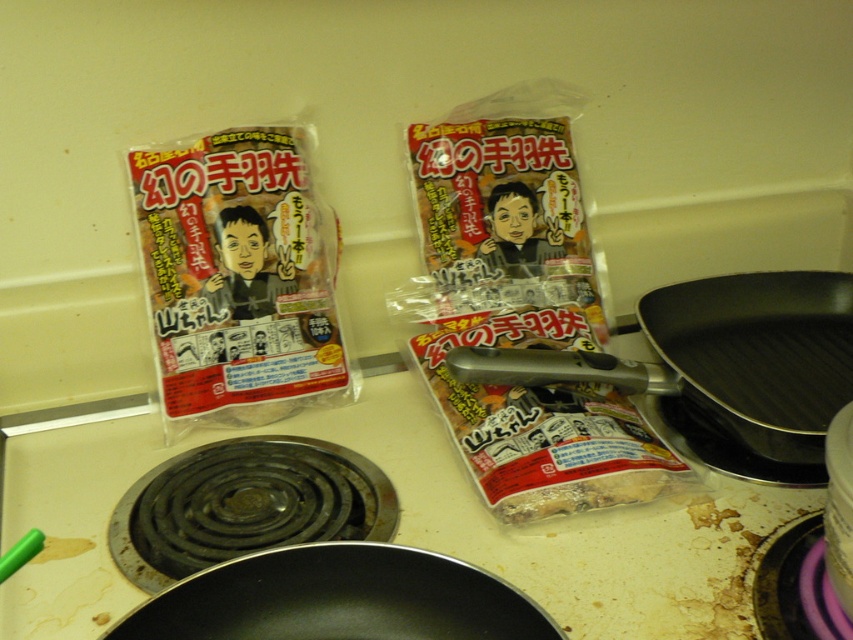
Is black matte gas stove at lower left below black non-stick frying pan at lower left?

No.

Who is more distant from viewer, (416, 416) or (225, 634)?

Positioned behind is point (416, 416).

Between point (364, 452) and point (196, 580), which one is positioned behind?

The point (364, 452) is behind.

Where is `black matte gas stove at lower left`? Image resolution: width=853 pixels, height=640 pixels. black matte gas stove at lower left is located at coordinates (561, 525).

Describe the element at coordinates (236, 280) in the screenshot. I see `matte plastic bag of chicken at left` at that location.

Does point (280, 129) come closer to viewer compared to point (843, 356)?

Yes, it is.

This screenshot has height=640, width=853. Describe the element at coordinates (236, 280) in the screenshot. I see `matte plastic bag of chicken at left` at that location.

At what (x,y) coordinates should I click in order to perform the action: click on matte plastic bag of chicken at left. Please return your answer as a coordinate pair (x, y). This screenshot has height=640, width=853. Looking at the image, I should click on (236, 280).

Does matte plastic bag of chicken at left have a greater width compared to black non-stick frying pan at lower left?

No, matte plastic bag of chicken at left is not wider than black non-stick frying pan at lower left.

Who is positioned more to the right, matte plastic bag of chicken at left or black non-stick frying pan at lower left?

black non-stick frying pan at lower left is more to the right.

Is point (180, 227) positioned behind point (538, 632)?

Yes, point (180, 227) is farther from viewer.

You are a GUI agent. You are given a task and a screenshot of the screen. Output one action in this format:
    pyautogui.click(x=<x>, y=<y>)
    Task: Click on the matte plastic bag of chicken at left
    This screenshot has height=640, width=853.
    Given the screenshot: What is the action you would take?
    pyautogui.click(x=236, y=280)